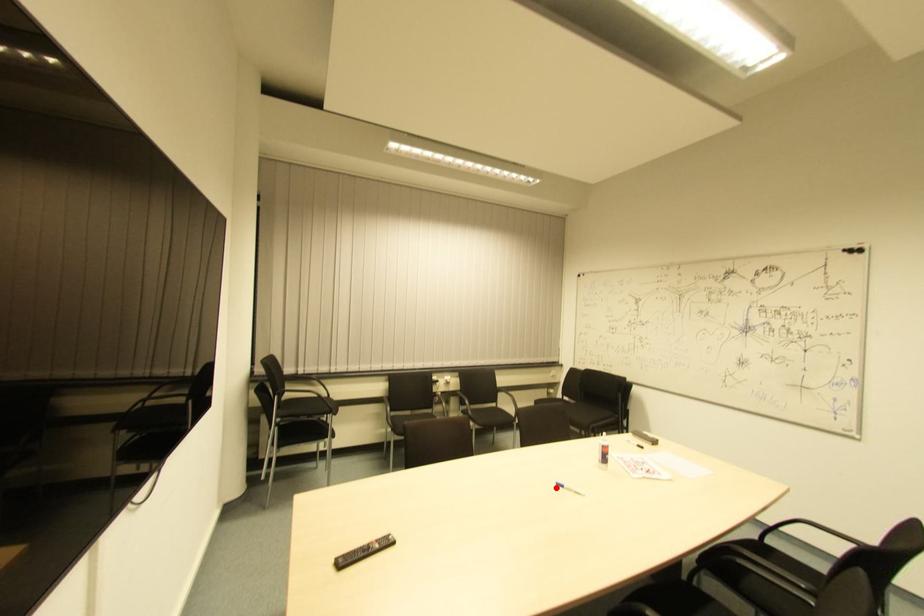
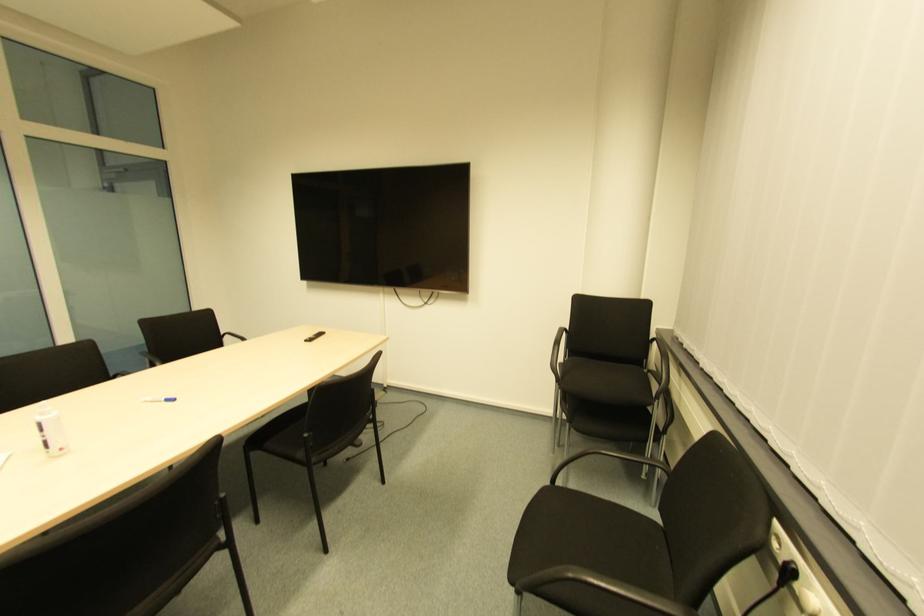
Find the pixel in the second image that matches the highlighted location in the first image.

(172, 403)